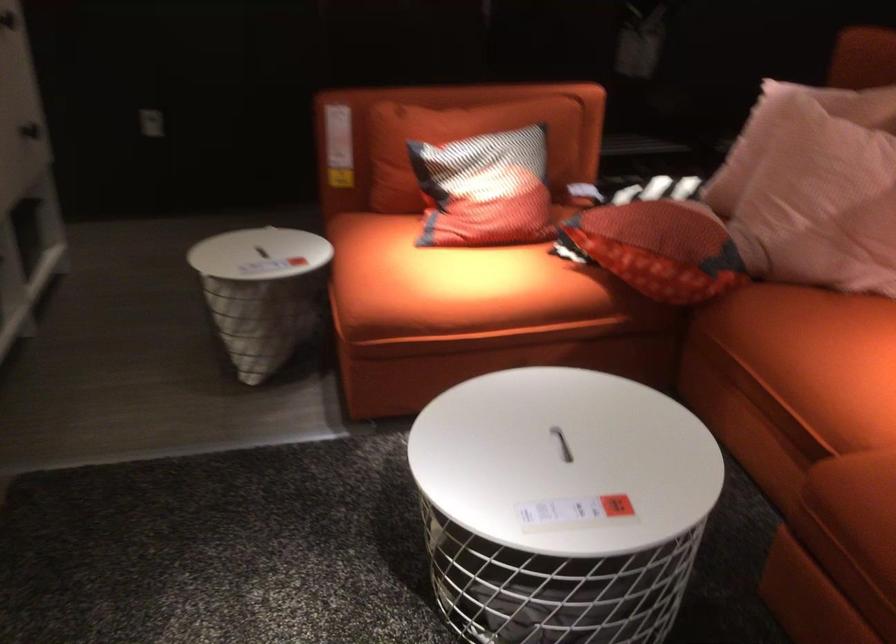
Identify the location of light pink pillow. (823, 198).